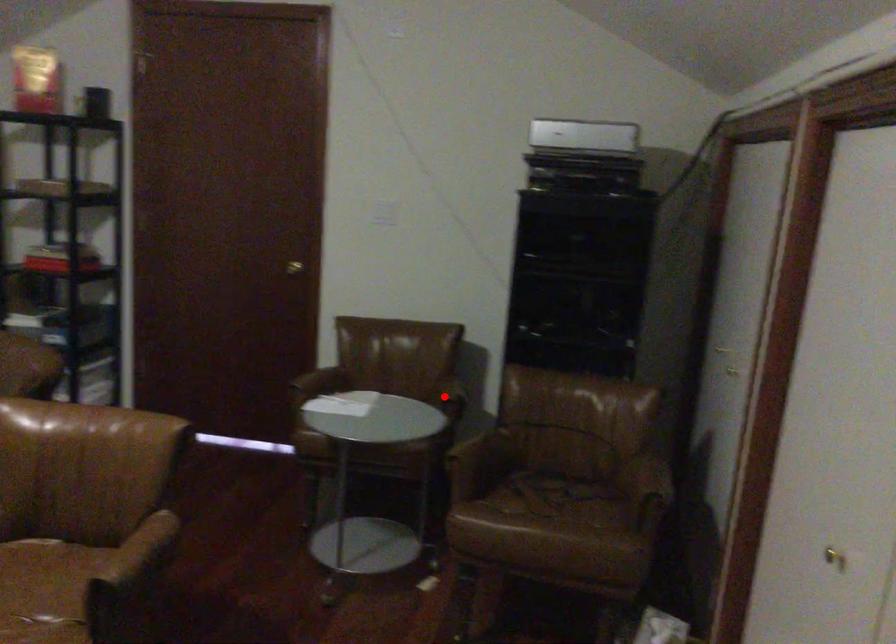
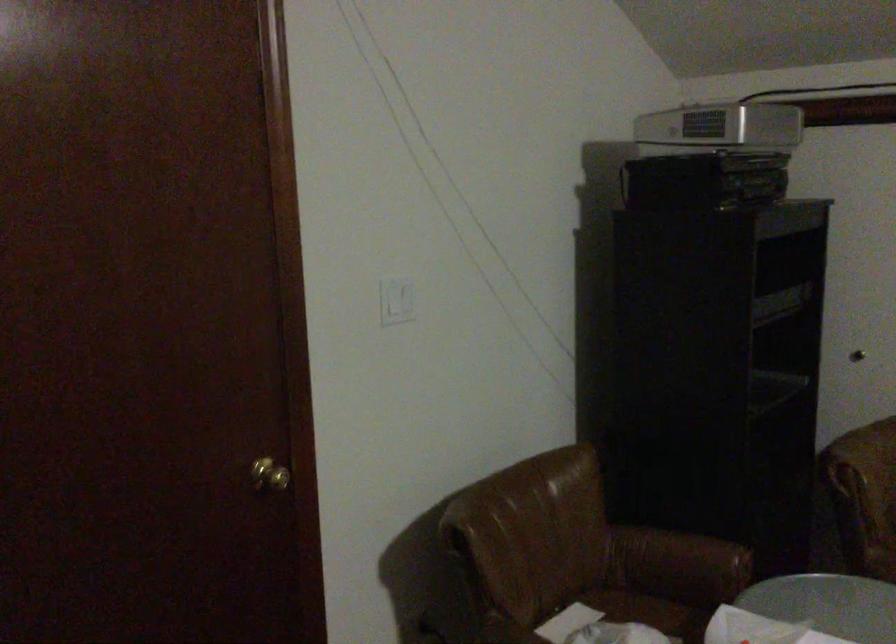
Where in the second image is the point corresponding to the highlighted location from the first image?

(679, 559)